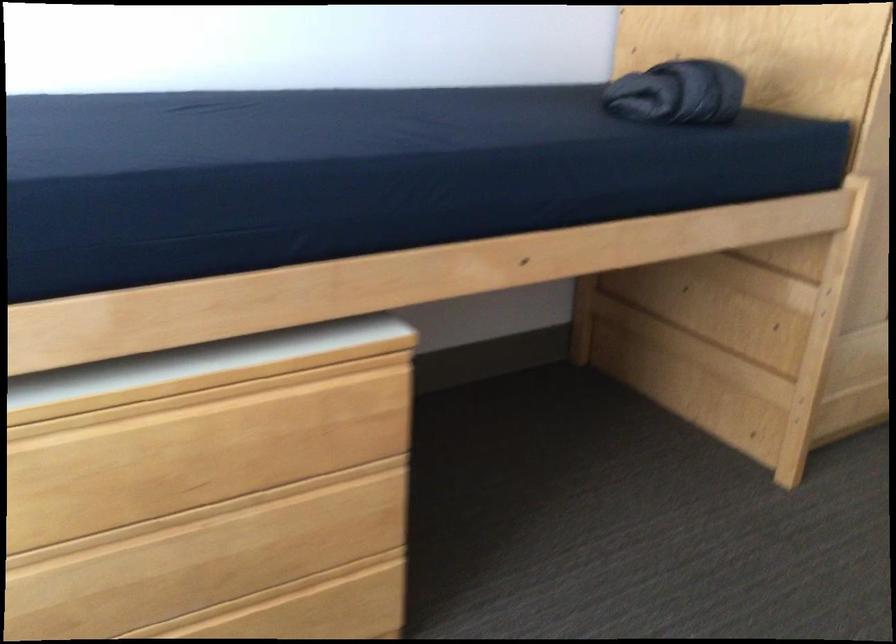
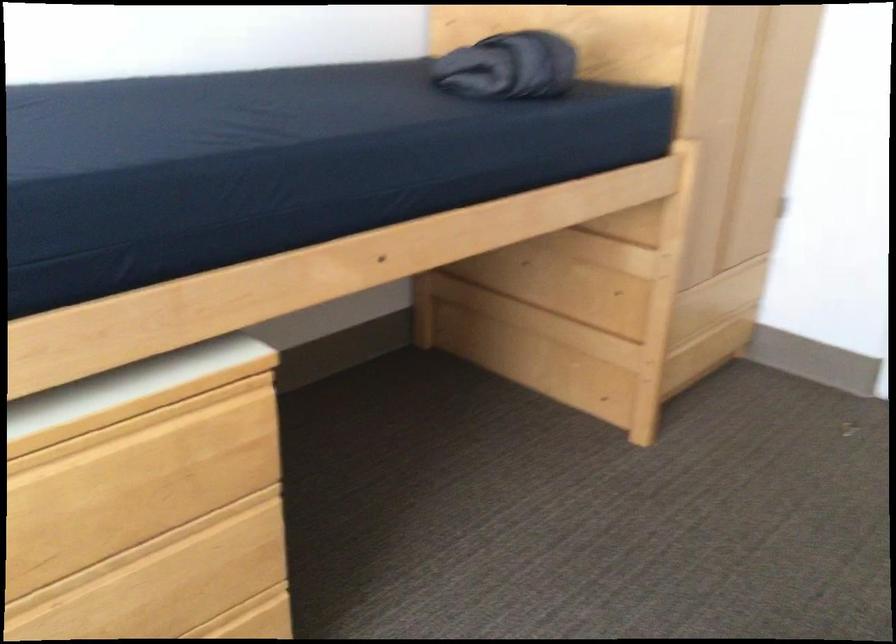
Where in the second image is the point corresponding to the point at 675,91 from the first image?

(509, 67)